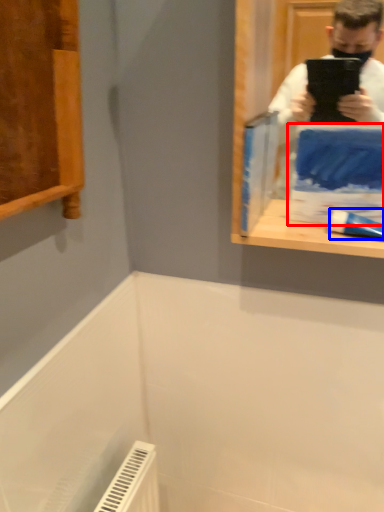
Question: Among these objects, which one is farthest to the camera, paperback book (highlighted by a red box) or toothpaste (highlighted by a blue box)?

Choices:
 (A) paperback book
 (B) toothpaste

Answer: (B)